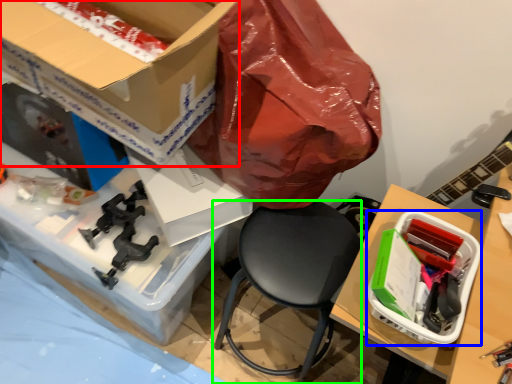
Question: Considering the real-world distances, which object is closest to box (highlighted by a red box)? box (highlighted by a blue box) or chair (highlighted by a green box).

Choices:
 (A) box
 (B) chair

Answer: (B)